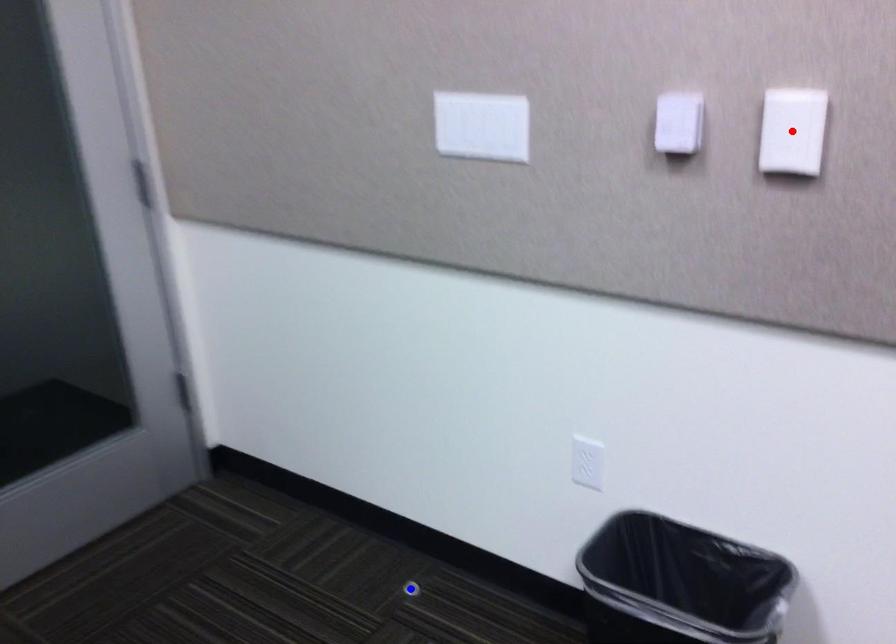
Question: Two points are marked on the image. Which point is closer to the camera?

Choices:
 (A) Blue point is closer.
 (B) Red point is closer.

Answer: (B)